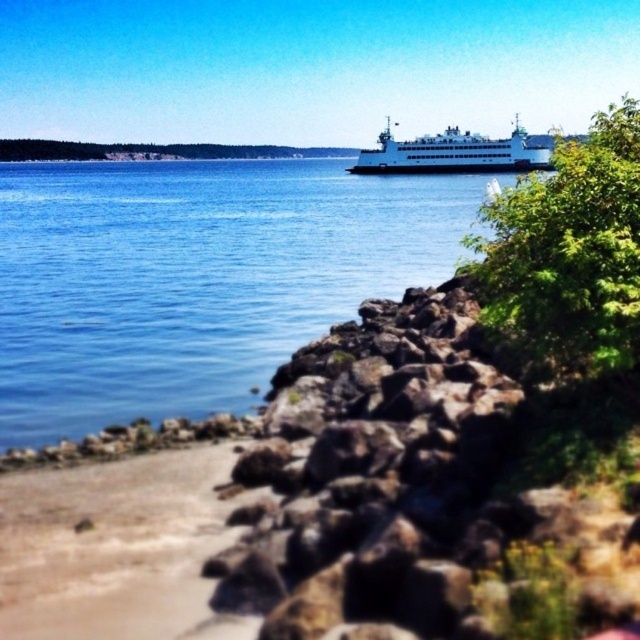
You are standing on the rocky shoreline and want to walk to the ferry boat. You notice the blue water at center and the green leafy tree at center right. Which object is wider from your perspective?

The blue water at center is wider than the green leafy tree at center right.

You are standing on the rocky shoreline and want to take a photo of the blue water at center and the green leafy tree at center right. Which object should you focus on first if you want to capture both in a single shot without moving the camera?

The blue water at center is positioned over the green leafy tree at center right, so you should focus on the blue water at center first to ensure it is in the foreground and properly framed.

You are planning to set up a picnic area near the sandy beach at lower left and the green leafy tree at center right. Which of these two locations has more space available for setting up the picnic?

The sandy beach at lower left is smaller than the green leafy tree at center right, so the green leafy tree at center right has more space available for setting up the picnic.